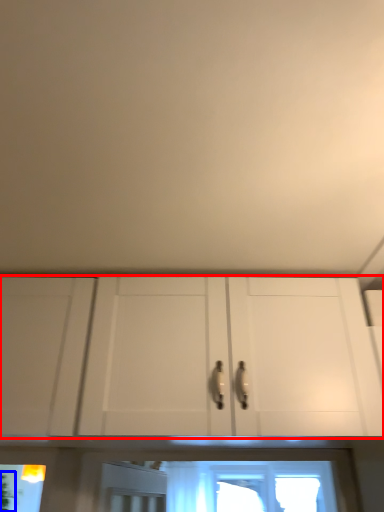
Question: Among these objects, which one is nearest to the camera, cabinetry (highlighted by a red box) or plant (highlighted by a blue box)?

Choices:
 (A) cabinetry
 (B) plant

Answer: (A)